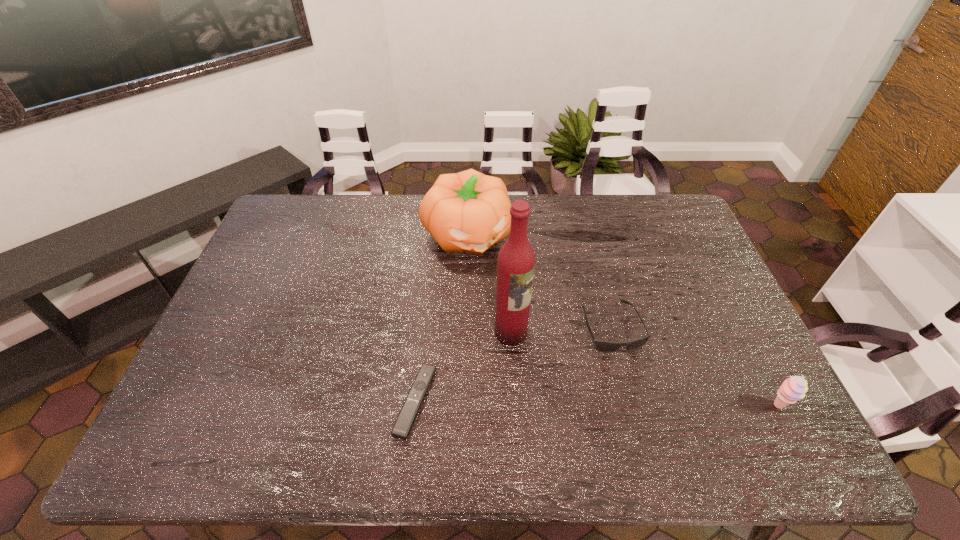
This screenshot has height=540, width=960. I want to click on the shortest object, so click(x=408, y=413).

At what (x,y) coordinates should I click in order to perform the action: click on sherbert. Please return your answer as a coordinate pair (x, y). Looking at the image, I should click on [x=794, y=388].

You are a GUI agent. You are given a task and a screenshot of the screen. Output one action in this format:
    pyautogui.click(x=<x>, y=<y>)
    Task: Click on the third tallest object
    The image size is (960, 540).
    Given the screenshot: What is the action you would take?
    pyautogui.click(x=794, y=388)

The image size is (960, 540). Find the location of `the second tallest object`. the second tallest object is located at coordinates (468, 211).

Find the location of a particular element. the farthest object is located at coordinates (468, 211).

The height and width of the screenshot is (540, 960). Identify the location of liquor. (516, 260).

What are the coordinates of `sunglasses` in the screenshot? It's located at (604, 346).

Image resolution: width=960 pixels, height=540 pixels. I want to click on the second object from right to left, so click(x=604, y=346).

Locate an element on the screen. blank space located on the back of the shortest object is located at coordinates (424, 318).

In order to click on vacant space located 0.130m on the back of the third shortest object in this screenshot , I will do [751, 353].